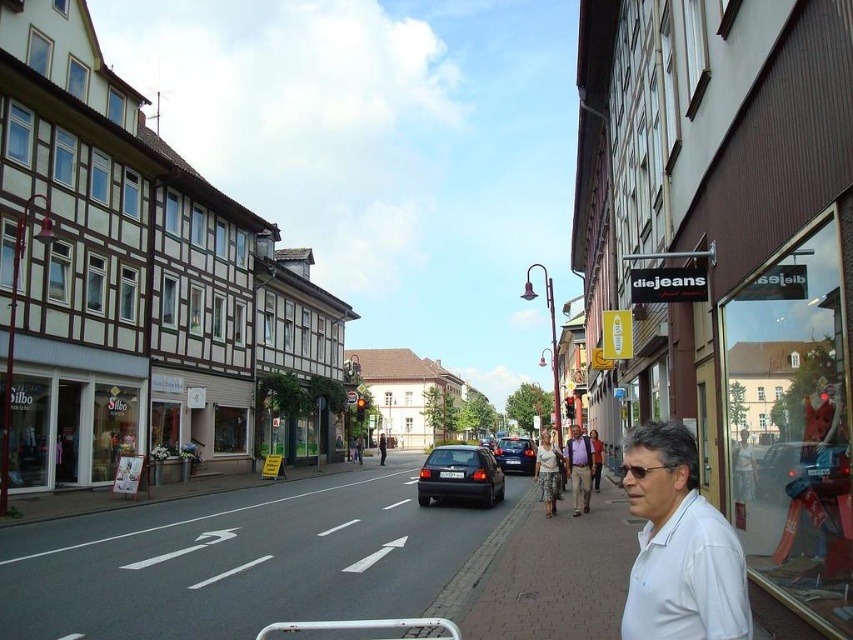
Is point (583, 472) behind point (514, 445)?

No, (583, 472) is in front of (514, 445).

Is white shirt at lower right to the left of shiny black sedan at center from the viewer's perspective?

Indeed, white shirt at lower right is positioned on the left side of shiny black sedan at center.

Which is in front, point (589, 502) or point (529, 465)?

Point (589, 502) is more forward.

Locate an element on the screen. Image resolution: width=853 pixels, height=640 pixels. white shirt at lower right is located at coordinates (579, 468).

Locate an element on the screen. Image resolution: width=853 pixels, height=640 pixels. white matte shirt at center is located at coordinates (679, 545).

Can you confirm if white matte shirt at center is taller than shiny black hatchback at center?

No.

Find the location of a particular element. This screenshot has width=853, height=640. white matte shirt at center is located at coordinates (679, 545).

Does shiny black hatchback at center have a lesser height compared to white cotton blouse at center?

Yes, shiny black hatchback at center is shorter than white cotton blouse at center.

Between shiny black hatchback at center and white cotton blouse at center, which one appears on the right side from the viewer's perspective?

Positioned to the right is white cotton blouse at center.

Find the location of a particular element. The width and height of the screenshot is (853, 640). shiny black hatchback at center is located at coordinates (460, 476).